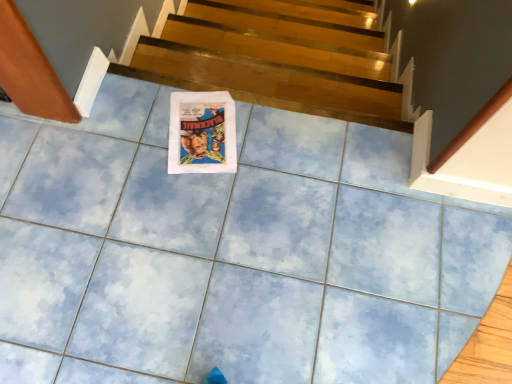
Question: Visually, is matte paper poster at center positioned to the left or to the right of wooden at upper center?

Choices:
 (A) left
 (B) right

Answer: (A)

Question: Is matte paper poster at center wider or thinner than wooden at upper center?

Choices:
 (A) wide
 (B) thin

Answer: (A)

Question: From the image's perspective, is matte paper poster at center above or below wooden at upper center?

Choices:
 (A) below
 (B) above

Answer: (A)

Question: Considering the positions of wooden at upper center and matte paper poster at center in the image, is wooden at upper center wider or thinner than matte paper poster at center?

Choices:
 (A) thin
 (B) wide

Answer: (A)

Question: Considering the relative positions of wooden at upper center and matte paper poster at center in the image provided, is wooden at upper center to the left or to the right of matte paper poster at center?

Choices:
 (A) left
 (B) right

Answer: (B)

Question: Considering the positions of wooden at upper center and matte paper poster at center in the image, is wooden at upper center taller or shorter than matte paper poster at center?

Choices:
 (A) tall
 (B) short

Answer: (A)

Question: Is point (275, 105) closer or farther from the camera than point (232, 109)?

Choices:
 (A) closer
 (B) farther

Answer: (B)